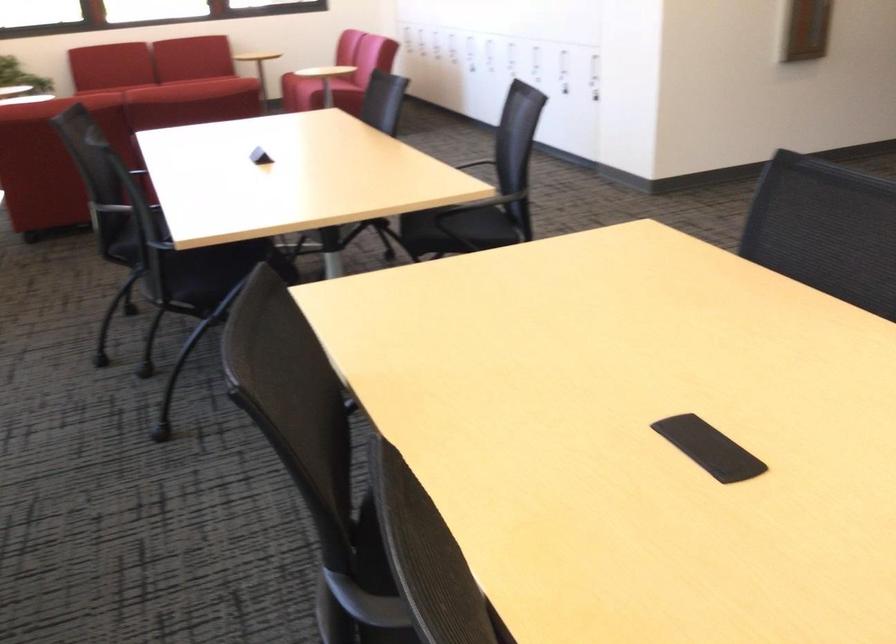
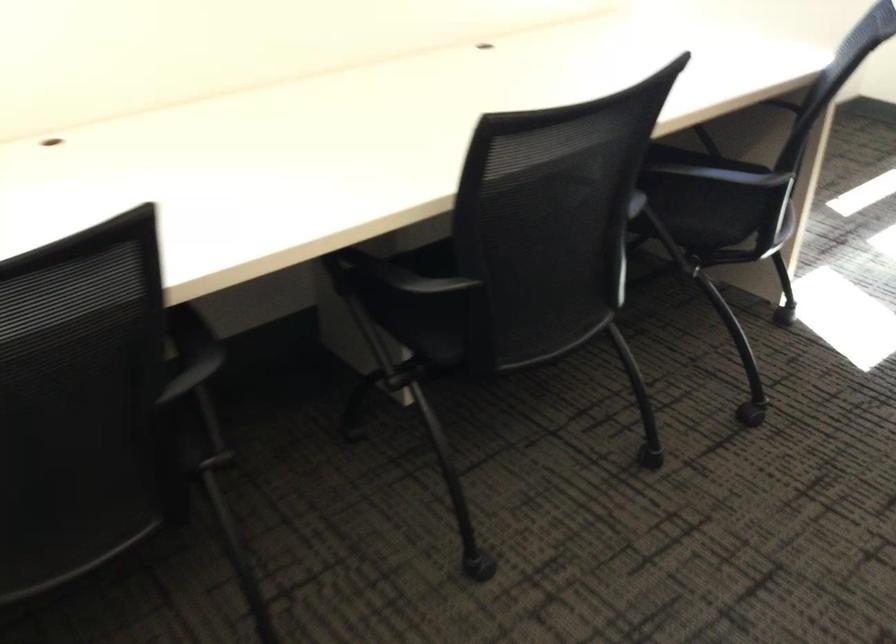
How did the camera likely rotate?

The rotation direction of the camera is left-down.